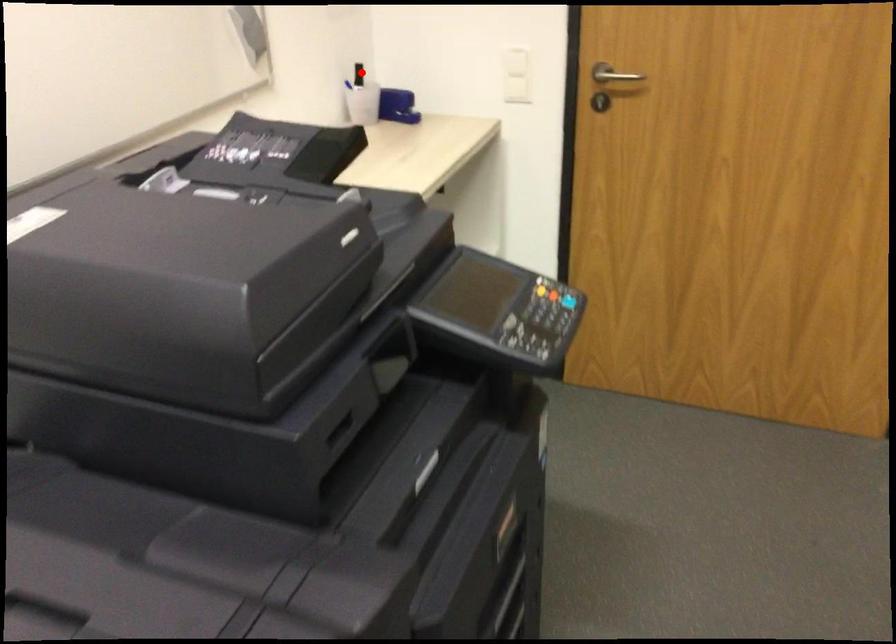
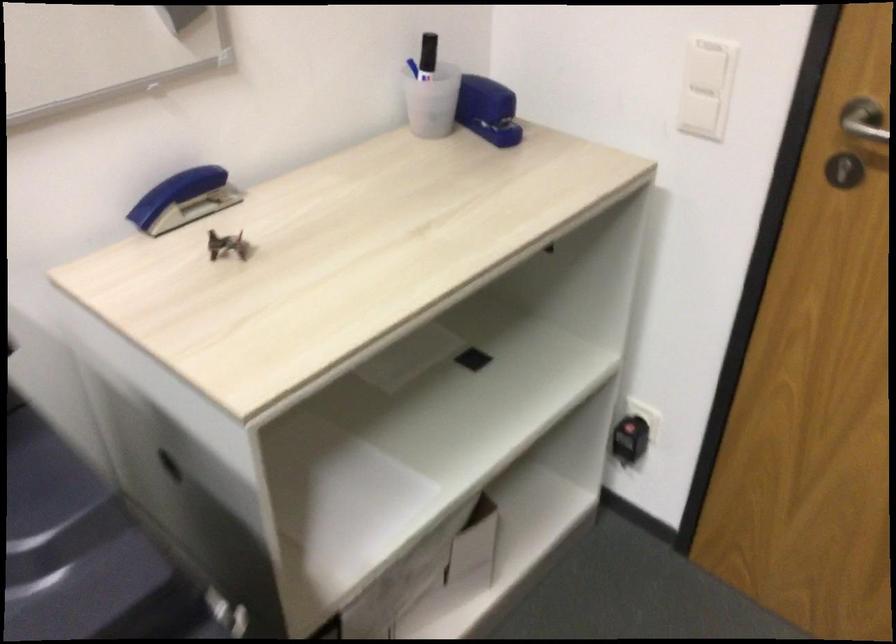
Question: I am providing you with two images of the same scene from different viewpoints. Image1 has a red point marked. In image2, the corresponding 3D location appears at what relative position? Reply with the corresponding letter.

Choices:
 (A) Closer
 (B) Farther

Answer: (A)